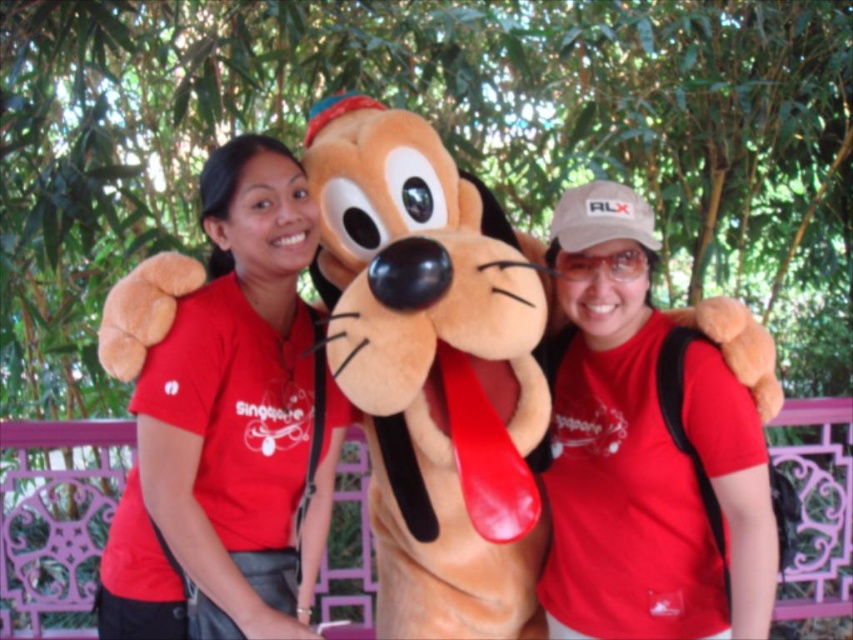
Can you confirm if matte red shirt at center is shorter than matte red t-shirt at center?

Incorrect, matte red shirt at center's height does not fall short of matte red t-shirt at center's.

Is matte red shirt at center positioned before matte red t-shirt at center?

That is True.

Identify the location of matte red shirt at center. (230, 426).

What are the coordinates of `matte red shirt at center` in the screenshot? It's located at (230, 426).